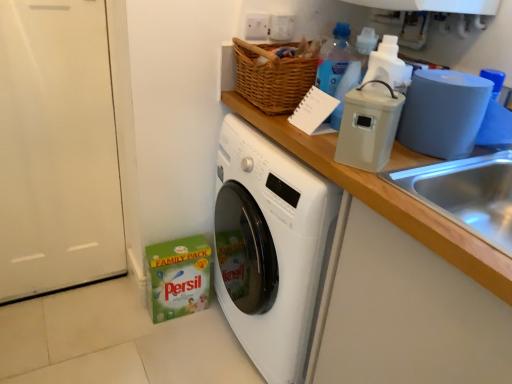
Question: From a real-world perspective, is blue translucent bottle at upper center, which appears as the second bottle when ordered from the bottom, physically located above or below wooden at upper right?

Choices:
 (A) above
 (B) below

Answer: (A)

Question: Relative to wooden at upper right, is blue translucent bottle at upper center, which appears as the second bottle when ordered from the bottom, in front or behind?

Choices:
 (A) behind
 (B) front

Answer: (A)

Question: Which object is positioned farthest from the blue matte toilet paper at right?

Choices:
 (A) wooden at upper right
 (B) beige plastic container at upper right
 (C) blue translucent bottle at upper center, placed as the 1th bottle when sorted from top to bottom
 (D) translucent plastic bottle at upper right, positioned as the second bottle in top-to-bottom order

Answer: (C)

Question: Estimate the real-world distances between objects in this image. Which object is closer to the blue translucent bottle at upper center, placed as the 1th bottle when sorted from top to bottom?

Choices:
 (A) translucent plastic bottle at upper right, positioned as the first bottle in front-to-back order
 (B) wooden at upper right
 (C) beige plastic container at upper right
 (D) blue matte toilet paper at right

Answer: (A)